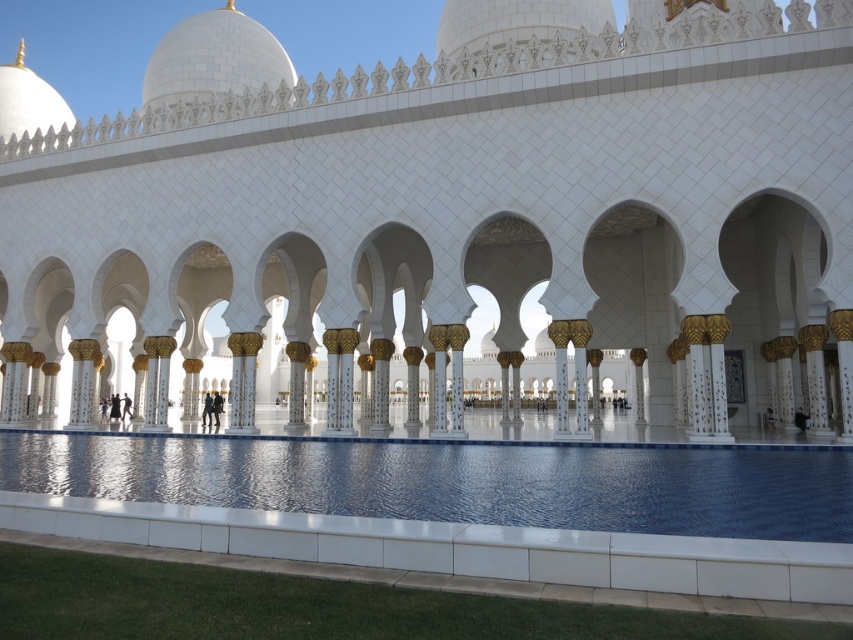
You are an architect analyzing the symmetry of the white marble palace at center and the white marble dome at upper center. Which one is placed to the left in the image?

The white marble dome at upper center is positioned to the left of the white marble palace at center.

You are a tourist standing in front of the white marble palace at center and the blue glossy water at center. Which object is positioned higher from the ground?

The white marble palace at center is located above the blue glossy water at center, so it is positioned higher from the ground.

You are standing in front of the mosque and want to take a photo of the white marble dome at upper center without the blue glossy water at center appearing in the frame. Is this possible given their positions?

The blue glossy water at center is in front of the white marble dome at upper center, so it would block the dome from view. Therefore, you cannot take a photo of the white marble dome at upper center without the blue glossy water at center appearing in the frame.